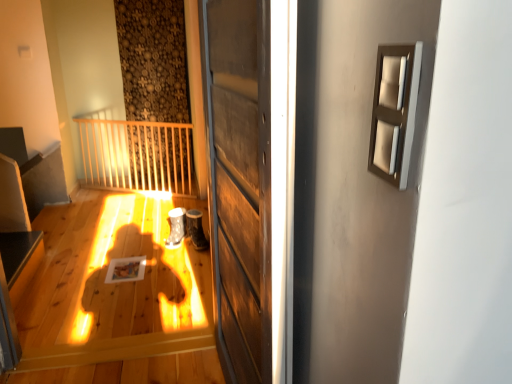
Where is `smooth black surface at lower left`? The height and width of the screenshot is (384, 512). smooth black surface at lower left is located at coordinates tap(17, 251).

Looking at their sizes, would you say smooth black surface at lower left is wider or thinner than wooden door at center?

In the image, smooth black surface at lower left appears to be wider than wooden door at center.

Is the depth of smooth black surface at lower left greater than that of wooden door at center?

Yes.

Can you confirm if smooth black surface at lower left is taller than wooden door at center?

Incorrect, the height of smooth black surface at lower left is not larger of that of wooden door at center.

How distant is smooth black surface at lower left from wooden door at center?

A distance of 4.87 feet exists between smooth black surface at lower left and wooden door at center.

Considering the sizes of satin beige frame at upper right and smooth black surface at lower left in the image, is satin beige frame at upper right taller or shorter than smooth black surface at lower left?

In the image, satin beige frame at upper right appears to be shorter than smooth black surface at lower left.

You are a GUI agent. You are given a task and a screenshot of the screen. Output one action in this format:
    pyautogui.click(x=<x>, y=<y>)
    Task: Click on the window located in front of the smooth black surface at lower left
    
    Given the screenshot: What is the action you would take?
    pyautogui.click(x=394, y=111)

Between point (406, 172) and point (6, 258), which one is positioned behind?

The point (6, 258) is farther.

Is satin beige frame at upper right wider or thinner than smooth black surface at lower left?

Considering their sizes, satin beige frame at upper right looks slimmer than smooth black surface at lower left.

Is satin beige frame at upper right positioned in front of wooden door at center?

That is True.

Is point (399, 109) more distant than point (257, 233)?

No.

Considering the positions of objects satin beige frame at upper right and wooden door at center in the image provided, who is more to the right, satin beige frame at upper right or wooden door at center?

satin beige frame at upper right is more to the right.

From the image's perspective, which is above, satin beige frame at upper right or wooden door at center?

satin beige frame at upper right appears higher in the image.

Choose the correct answer: Is wooden door at center inside smooth black surface at lower left or outside it?

wooden door at center exists outside the volume of smooth black surface at lower left.

Where is `door above the smooth black surface at lower left (from the image's perspective)`? The width and height of the screenshot is (512, 384). door above the smooth black surface at lower left (from the image's perspective) is located at coordinates (239, 180).

From the image's perspective, is wooden door at center above smooth black surface at lower left?

Yes, from the image's perspective, wooden door at center is over smooth black surface at lower left.

Considering the positions of point (261, 227) and point (6, 268), is point (261, 227) closer or farther from the camera than point (6, 268)?

Clearly, point (261, 227) is closer to the camera than point (6, 268).

Is wooden door at center smaller than satin beige frame at upper right?

No.

Measure the distance from wooden door at center to satin beige frame at upper right.

wooden door at center is 73.85 centimeters from satin beige frame at upper right.

Does wooden door at center come behind satin beige frame at upper right?

That is True.

Which of these two, wooden door at center or satin beige frame at upper right, is wider?

Wider between the two is wooden door at center.

From a real-world perspective, is smooth black surface at lower left physically located above or below satin beige frame at upper right?

Clearly, from a real-world perspective, smooth black surface at lower left is below satin beige frame at upper right.

How many degrees apart are the facing directions of smooth black surface at lower left and satin beige frame at upper right?

They differ by 179 degrees in their facing directions.

Which object is thinner, smooth black surface at lower left or satin beige frame at upper right?

With smaller width is satin beige frame at upper right.

Is smooth black surface at lower left bigger or smaller than satin beige frame at upper right?

In the image, smooth black surface at lower left appears to be larger than satin beige frame at upper right.

Locate an element on the screen. This screenshot has width=512, height=384. door above the smooth black surface at lower left (from a real-world perspective) is located at coordinates (239, 180).

Identify the location of window on the right of smooth black surface at lower left. (394, 111).

Looking at the image, which one is located further to satin beige frame at upper right, smooth black surface at lower left or wooden door at center?

smooth black surface at lower left is positioned further to the anchor satin beige frame at upper right.

Which object lies nearer to the anchor point wooden door at center, smooth black surface at lower left or satin beige frame at upper right?

Among the two, satin beige frame at upper right is located nearer to wooden door at center.

Which object lies nearer to the anchor point wooden door at center, satin beige frame at upper right or smooth black surface at lower left?

satin beige frame at upper right lies closer to wooden door at center than the other object.

When comparing their distances from smooth black surface at lower left, does satin beige frame at upper right or wooden door at center seem closer?

wooden door at center is closer to smooth black surface at lower left.

Based on their spatial positions, is wooden door at center or smooth black surface at lower left further from satin beige frame at upper right?

smooth black surface at lower left is further to satin beige frame at upper right.

Based on their spatial positions, is wooden door at center or satin beige frame at upper right further from smooth black surface at lower left?

The object further to smooth black surface at lower left is satin beige frame at upper right.

You are a GUI agent. You are given a task and a screenshot of the screen. Output one action in this format:
    pyautogui.click(x=<x>, y=<y>)
    Task: Click on the door between smooth black surface at lower left and satin beige frame at upper right
    The image size is (512, 384).
    Given the screenshot: What is the action you would take?
    pyautogui.click(x=239, y=180)